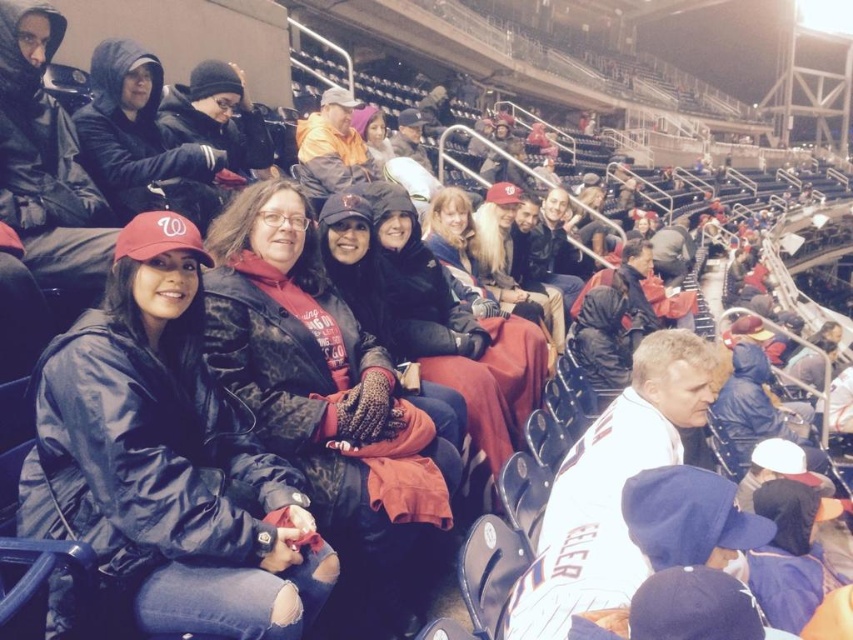
Who is shorter, camouflage jacket at center or matte black jacket at upper left?

Standing shorter between the two is matte black jacket at upper left.

Is point (344, 541) positioned after point (132, 211)?

No, (344, 541) is in front of (132, 211).

Image resolution: width=853 pixels, height=640 pixels. Find the location of `camouflage jacket at center`. camouflage jacket at center is located at coordinates (328, 404).

Find the location of a particular element. The width and height of the screenshot is (853, 640). camouflage jacket at center is located at coordinates (328, 404).

Which is more to the right, matte black jacket at left or matte black jacket at upper left?

matte black jacket at left is more to the right.

Does matte black jacket at left appear under matte black jacket at upper left?

Correct, matte black jacket at left is located below matte black jacket at upper left.

Does point (259, 515) come in front of point (148, 76)?

Yes, point (259, 515) is closer to viewer.

I want to click on matte black jacket at left, so (x=166, y=458).

Is matte black jacket at left taller than camouflage jacket at center?

Incorrect, matte black jacket at left's height is not larger of camouflage jacket at center's.

Is point (161, 477) less distant than point (357, 605)?

Yes, point (161, 477) is closer to viewer.

Measure the distance between point (164, 300) and camera.

Point (164, 300) and camera are 14.42 meters apart from each other.

The height and width of the screenshot is (640, 853). Find the location of `matte black jacket at left`. matte black jacket at left is located at coordinates (166, 458).